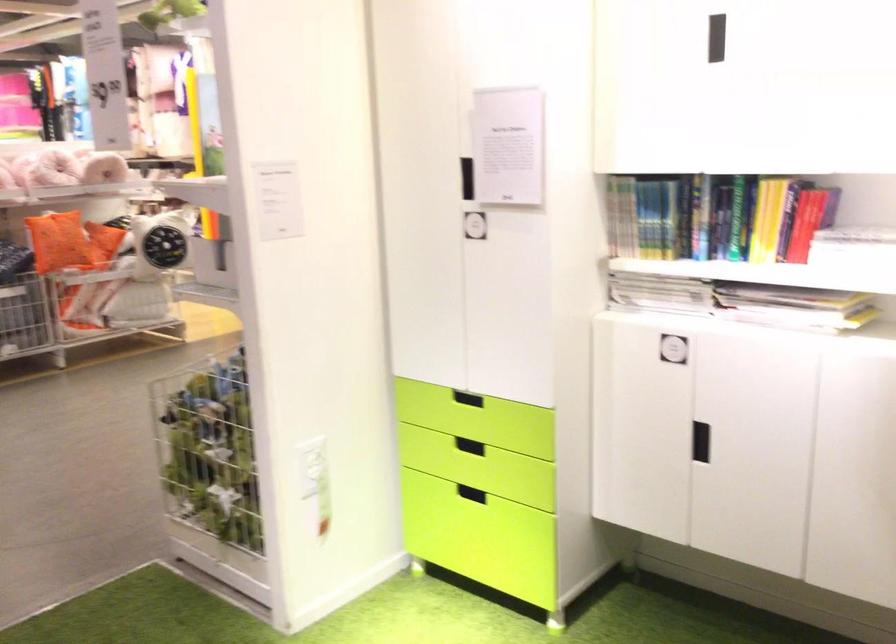
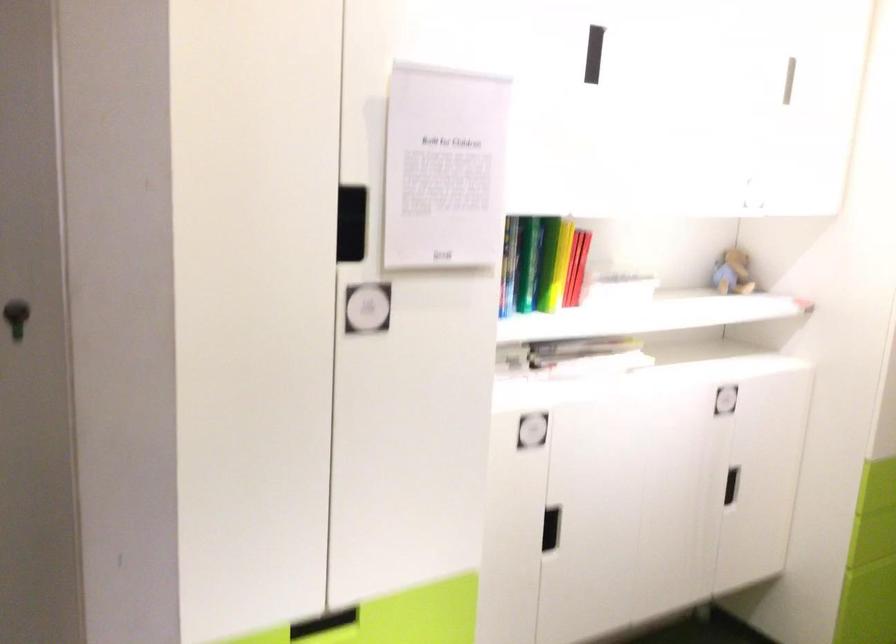
In the second image, find the point that corresponds to point (764, 214) in the first image.

(561, 263)